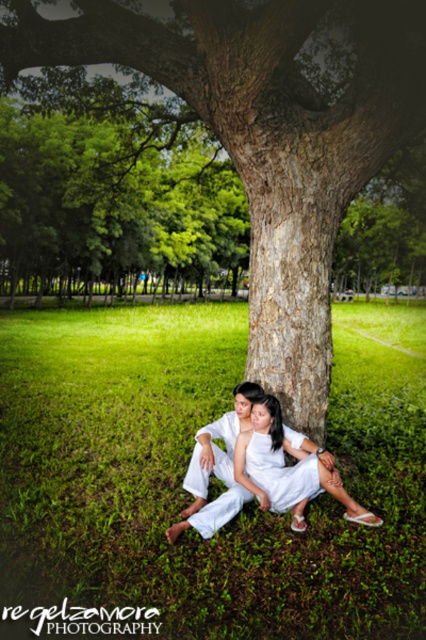
Question: Among these objects, which one is farthest from the camera?

Choices:
 (A) green rough bark tree at center
 (B) white cotton dress at center
 (C) white satin dress at center
 (D) green grass at lower center

Answer: (A)

Question: Does green grass at lower center have a greater width compared to green rough bark tree at center?

Choices:
 (A) yes
 (B) no

Answer: (A)

Question: Which of the following is the closest to the observer?

Choices:
 (A) [x=285, y=481]
 (B) [x=117, y=56]
 (C) [x=166, y=374]
 (D) [x=339, y=484]

Answer: (D)

Question: Can you confirm if green grass at lower center is positioned below white satin dress at center?

Choices:
 (A) no
 (B) yes

Answer: (A)

Question: Does white cotton dress at center have a larger size compared to white satin dress at center?

Choices:
 (A) yes
 (B) no

Answer: (A)

Question: Which object is positioned closest to the white satin dress at center?

Choices:
 (A) green grass at lower center
 (B) green rough bark tree at center

Answer: (A)